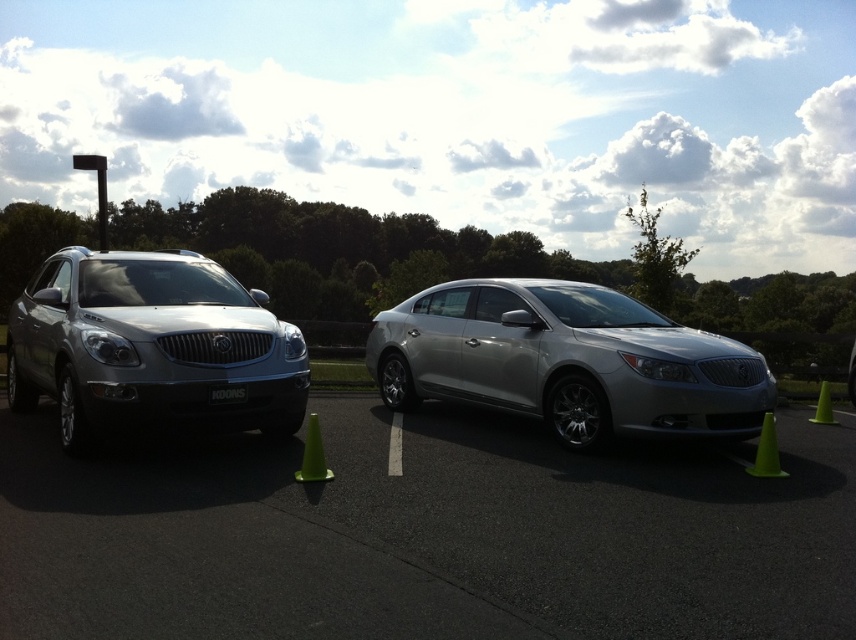
Question: Does green plastic traffic cone at lower right appear under black plastic license plate at center?

Choices:
 (A) no
 (B) yes

Answer: (B)

Question: Does satin silver suv at left appear over green plastic cone at lower left?

Choices:
 (A) yes
 (B) no

Answer: (A)

Question: Which of the following is the farthest from the observer?

Choices:
 (A) satin silver sedan at center
 (B) green plastic traffic cone at right
 (C) black plastic license plate at center

Answer: (B)

Question: Which of the following is the farthest from the observer?

Choices:
 (A) (512, 620)
 (B) (217, 387)
 (C) (333, 476)

Answer: (B)

Question: Is satin silver car at center below satin silver suv at left?

Choices:
 (A) no
 (B) yes

Answer: (B)

Question: Which of the following is the closest to the observer?

Choices:
 (A) green plastic traffic cone at right
 (B) green plastic cone at lower left
 (C) satin silver car at center

Answer: (C)